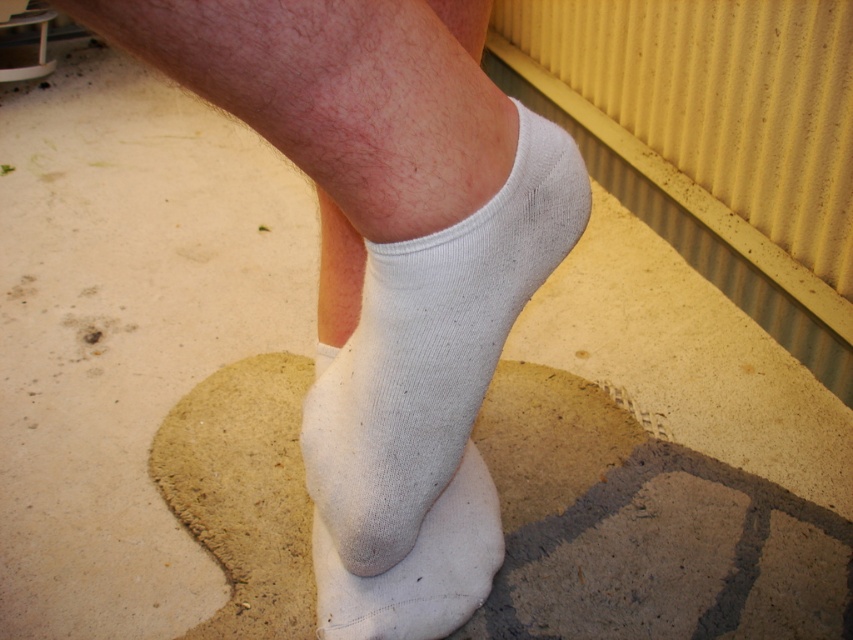
Based on the photo, you are standing in front of a textured surface that looks like a concrete or stone step. You notice a point marked at coordinates (357, 413) on the surface. If you want to place a 60 cm ruler exactly at that point, will the ruler fit entirely within your line of sight without overlapping the edges of the surface?

The point (357, 413) is 60.09 centimeters away from the viewer. Since the ruler is 60 cm long, it may fit within the line of sight if the surface extends sufficiently beyond the point. However, without knowing the surface dimensions, we can only confirm the distance to the point, not the space around it.

You are a photographer adjusting your camera to focus on two points in the image. The first point is point (500, 317) and the second is point (421, 260). Which point should you focus on first if you want to ensure the closest object is in focus?

Point (500, 317) is further to the camera than point (421, 260), so you should focus on point (421, 260) first since it is closer to the camera and needs to be in focus.

You are standing in front of the textured surface where the foot is placed. There are two points marked on the surface at coordinates point (396, 419) and point (480, 554). Which point is nearer to you?

Point (396, 419) is closer to the viewer than point (480, 554).